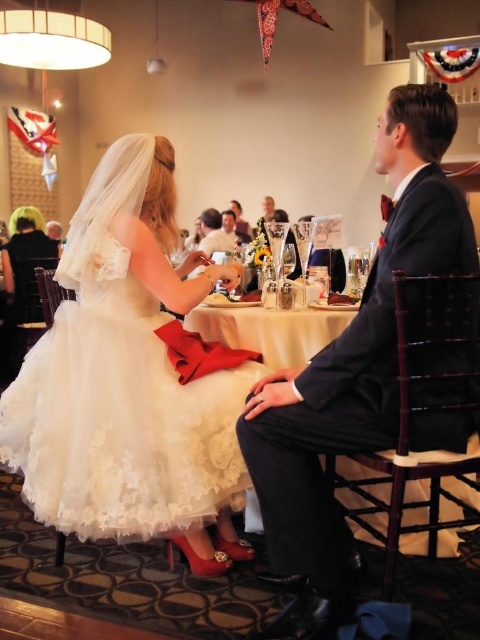
Question: Does shiny black suit at center come in front of white lace tablecloth at center?

Choices:
 (A) no
 (B) yes

Answer: (B)

Question: Among these objects, which one is nearest to the camera?

Choices:
 (A) white lace tablecloth at center
 (B) shiny black suit at center
 (C) white lace dress at center
 (D) matte black suit at center

Answer: (B)

Question: Which of the following is the farthest from the observer?

Choices:
 (A) (321, 340)
 (B) (189, 268)
 (C) (259, 486)
 (D) (224, 236)

Answer: (D)

Question: Does shiny black suit at center have a lesser width compared to matte black suit at center?

Choices:
 (A) yes
 (B) no

Answer: (B)

Question: Which of the following is the closest to the observer?

Choices:
 (A) (144, 163)
 (B) (245, 348)
 (C) (264, 536)
 (D) (216, 250)

Answer: (C)

Question: Can you confirm if white lace dress at center is positioned above shiny black suit at center?

Choices:
 (A) no
 (B) yes

Answer: (A)